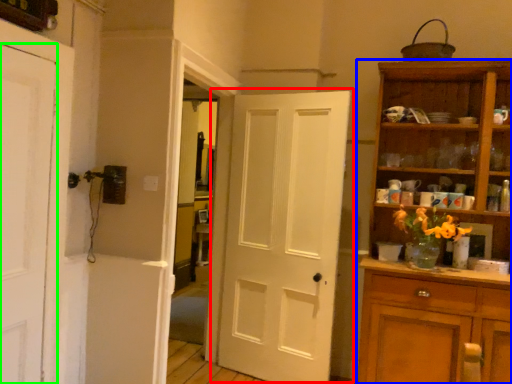
Question: Which is nearer to the door (highlighted by a red box)? cupboard (highlighted by a blue box) or door (highlighted by a green box).

Choices:
 (A) cupboard
 (B) door

Answer: (A)